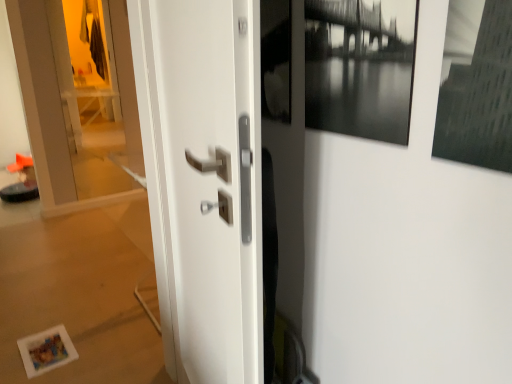
Question: Does white glossy door handle at center come in front of transparent glass door at left?

Choices:
 (A) yes
 (B) no

Answer: (A)

Question: Does white glossy door handle at center come behind transparent glass door at left?

Choices:
 (A) no
 (B) yes

Answer: (A)

Question: Is white glossy door handle at center aimed at transparent glass door at left?

Choices:
 (A) yes
 (B) no

Answer: (B)

Question: Is white glossy door handle at center shorter than transparent glass door at left?

Choices:
 (A) yes
 (B) no

Answer: (A)

Question: Is white glossy door handle at center taller than transparent glass door at left?

Choices:
 (A) yes
 (B) no

Answer: (B)

Question: Is black matte picture frame at upper right wider or thinner than transparent glass door at left?

Choices:
 (A) wide
 (B) thin

Answer: (A)

Question: From the image's perspective, is black matte picture frame at upper right positioned above or below transparent glass door at left?

Choices:
 (A) below
 (B) above

Answer: (A)

Question: Does point (324, 82) appear closer or farther from the camera than point (74, 132)?

Choices:
 (A) farther
 (B) closer

Answer: (B)

Question: In terms of height, does black matte picture frame at upper right look taller or shorter compared to transparent glass door at left?

Choices:
 (A) tall
 (B) short

Answer: (B)

Question: Would you say white glossy door handle at center is inside or outside black matte picture frame at upper right?

Choices:
 (A) outside
 (B) inside

Answer: (A)

Question: Looking at their shapes, would you say white glossy door handle at center is wider or thinner than black matte picture frame at upper right?

Choices:
 (A) wide
 (B) thin

Answer: (A)

Question: Is white glossy door handle at center bigger or smaller than black matte picture frame at upper right?

Choices:
 (A) big
 (B) small

Answer: (A)

Question: In terms of height, does white glossy door handle at center look taller or shorter compared to black matte picture frame at upper right?

Choices:
 (A) short
 (B) tall

Answer: (B)

Question: Is transparent glass door at left in front of or behind white glossy door handle at center in the image?

Choices:
 (A) behind
 (B) front

Answer: (A)

Question: Is transparent glass door at left inside or outside of white glossy door handle at center?

Choices:
 (A) outside
 (B) inside

Answer: (A)